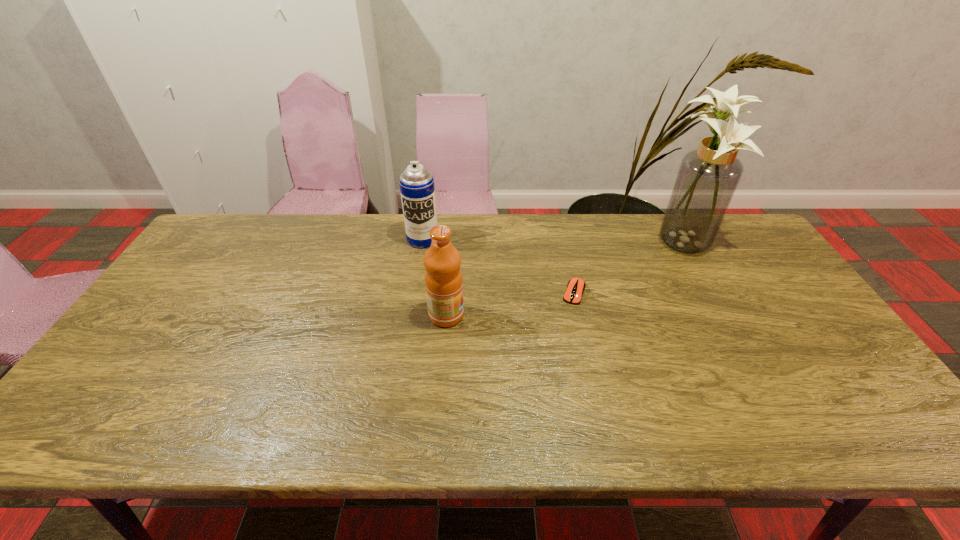
In order to click on the rightmost object in this screenshot , I will do `click(707, 179)`.

What are the coordinates of `flower arrangement` in the screenshot? It's located at [707, 179].

Identify the location of fruit juice. (443, 278).

Find the location of `aerosol can`. aerosol can is located at coordinates (417, 189).

Find the location of `the shortest object`. the shortest object is located at coordinates (575, 288).

You are a GUI agent. You are given a task and a screenshot of the screen. Output one action in this format:
    pyautogui.click(x=<x>, y=<y>)
    Task: Click on the third object from left to right
    
    Given the screenshot: What is the action you would take?
    pyautogui.click(x=575, y=288)

Locate an element on the screen. This screenshot has width=960, height=540. vacant space located 0.350m on the front of the tallest object is located at coordinates (740, 354).

This screenshot has width=960, height=540. What are the coordinates of `vacant position located on the label side of the fruit juice` in the screenshot? It's located at (508, 315).

This screenshot has height=540, width=960. Identify the location of vacant space located on the label side of the aerosol can. (418, 274).

This screenshot has height=540, width=960. I want to click on vacant region located 0.100m on the front of the second object from right to left, so click(583, 332).